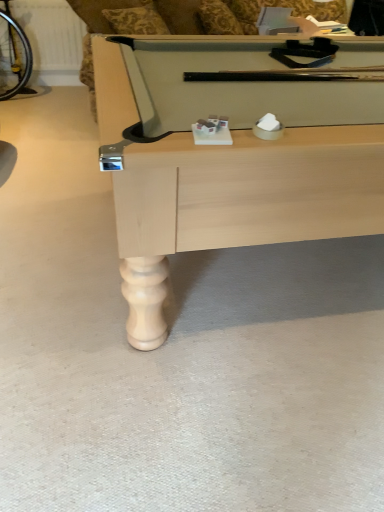
You are a GUI agent. You are given a task and a screenshot of the screen. Output one action in this format:
    pyautogui.click(x=<x>, y=<y>)
    Task: Click on the metallic yellow wheel at left
    
    Given the screenshot: What is the action you would take?
    pyautogui.click(x=13, y=57)

What do you see at coordinates (13, 57) in the screenshot? I see `metallic yellow wheel at left` at bounding box center [13, 57].

The image size is (384, 512). Identify the location of metallic yellow wheel at left. (13, 57).